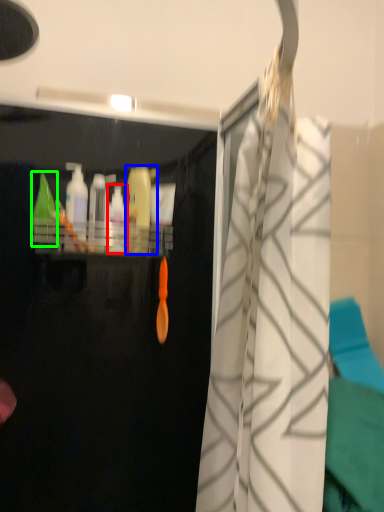
Question: Which object is positioned closest to cleaning product (highlighted by a red box)? Select from cleaning product (highlighted by a blue box) and cleaning product (highlighted by a green box).

Choices:
 (A) cleaning product
 (B) cleaning product

Answer: (A)